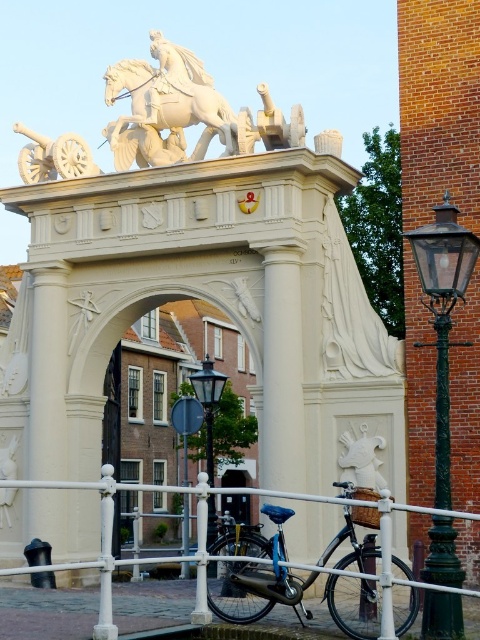
You are a tourist standing in front of the gateway and want to take a photo of the white marble horse at upper center and the black glass lamp post at center. Which object should you focus on first if you want to capture both in a single frame without moving the camera?

You should focus on the black glass lamp post at center first because the white marble horse at upper center is positioned over it, meaning they are aligned vertically. This allows both to be captured in the same frame without needing to adjust the camera angle.

You are standing in front of the grand gateway and want to take a photo of the point at coordinate (169, 102). Your camera has a maximum focus range of 70 meters. Will the camera be able to focus on that point?

The point at coordinate (169, 102) is 69.21 meters away from the camera. Since the camera can focus up to 70 meters, it will be able to focus on that point.

You are standing in front of the gateway and notice two points marked on it. The first point is at coordinates point [117,532] and the second is at point [213,529]. Which of these points is closer to you?

Point [117,532] is closer to you because it is further to the viewer than point [213,529].